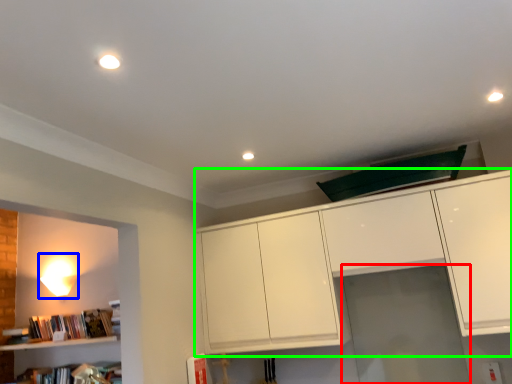
Question: Considering the real-world distances, which object is closest to glass door (highlighted by a red box)? lamp (highlighted by a blue box) or cabinetry (highlighted by a green box).

Choices:
 (A) lamp
 (B) cabinetry

Answer: (B)